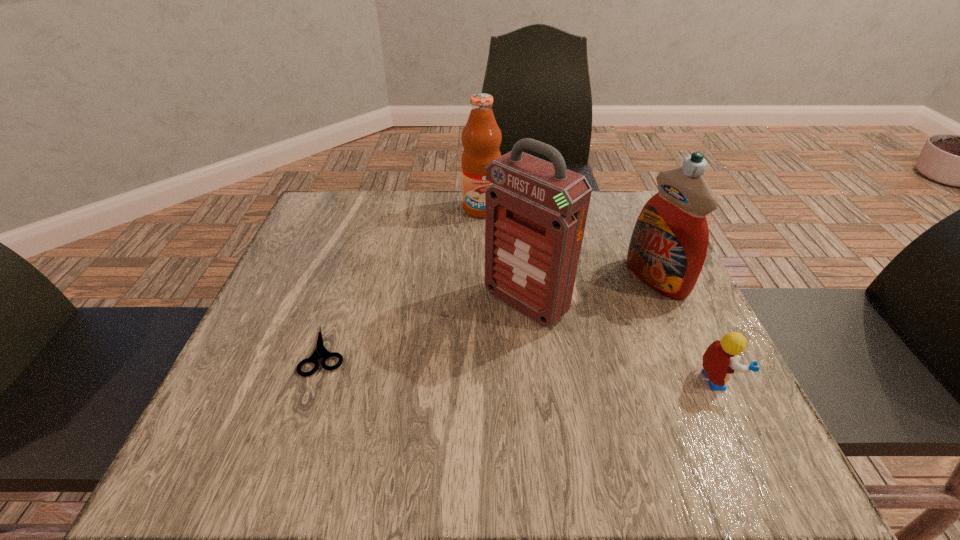
Locate an element on the screen. free region located on the front label of the fruit juice is located at coordinates (488, 231).

You are a GUI agent. You are given a task and a screenshot of the screen. Output one action in this format:
    pyautogui.click(x=<x>, y=<y>)
    Task: Click on the free space located 0.140m on the front label of the fruit juice
    The image size is (960, 540).
    Given the screenshot: What is the action you would take?
    pyautogui.click(x=494, y=253)

At what (x,y) coordinates should I click in order to perform the action: click on free space located 0.280m on the front label of the fruit juice. Please return your answer as a coordinate pair (x, y). Looking at the image, I should click on (507, 293).

Identify the location of free point located on the front-facing side of the tallest object. [x=425, y=388].

This screenshot has width=960, height=540. What are the coordinates of `free location located 0.050m on the front-facing side of the tallest object` in the screenshot? It's located at (482, 339).

Identify the location of vacant area located on the front-facing side of the tallest object. Image resolution: width=960 pixels, height=540 pixels. (453, 364).

The height and width of the screenshot is (540, 960). I want to click on object that is at the far edge, so click(481, 137).

Identify the location of shears that is positioned at the near edge. This screenshot has width=960, height=540. (320, 351).

Where is `Lego that is at the near edge`? The width and height of the screenshot is (960, 540). Lego that is at the near edge is located at coordinates (720, 360).

Locate an element on the screen. object located at the left edge is located at coordinates (320, 351).